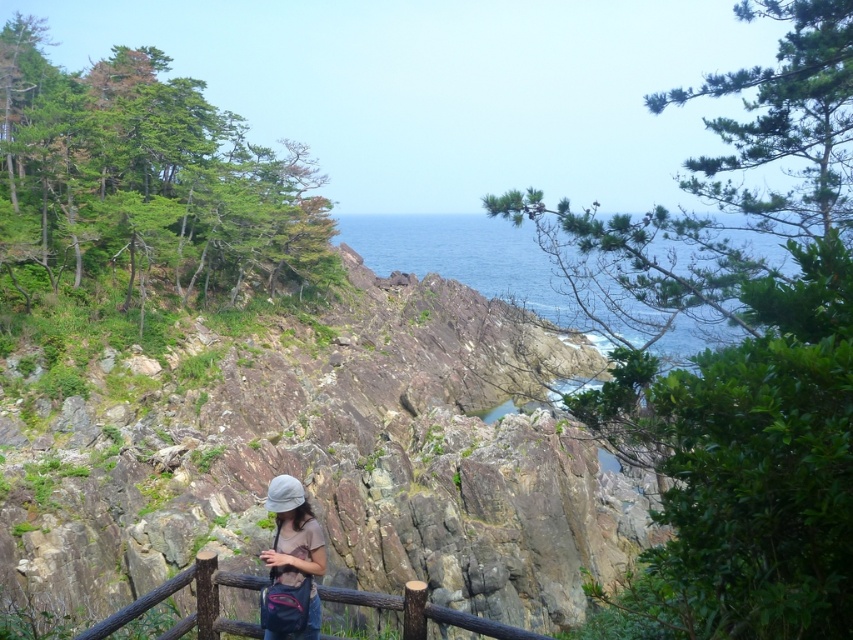
Is rusty stone hillside at center to the right of brown wooden fence at lower center from the viewer's perspective?

Indeed, rusty stone hillside at center is positioned on the right side of brown wooden fence at lower center.

Does rusty stone hillside at center have a greater height compared to brown wooden fence at lower center?

Yes.

Does point (486, 316) come farther from viewer compared to point (209, 593)?

Yes.

Identify the location of rusty stone hillside at center. The width and height of the screenshot is (853, 640). (323, 458).

Is the position of blue water at center less distant than that of matte gray hat at center?

No, blue water at center is further to the viewer.

Which is above, blue water at center or matte gray hat at center?

Positioned higher is blue water at center.

What do you see at coordinates (463, 257) in the screenshot? This screenshot has height=640, width=853. I see `blue water at center` at bounding box center [463, 257].

The height and width of the screenshot is (640, 853). Identify the location of blue water at center. (463, 257).

Who is higher up, rusty stone hillside at center or blue water at center?

blue water at center is higher up.

Who is more forward, (521, 337) or (686, 336)?

Point (686, 336) is more forward.

The image size is (853, 640). Identify the location of rusty stone hillside at center. (323, 458).